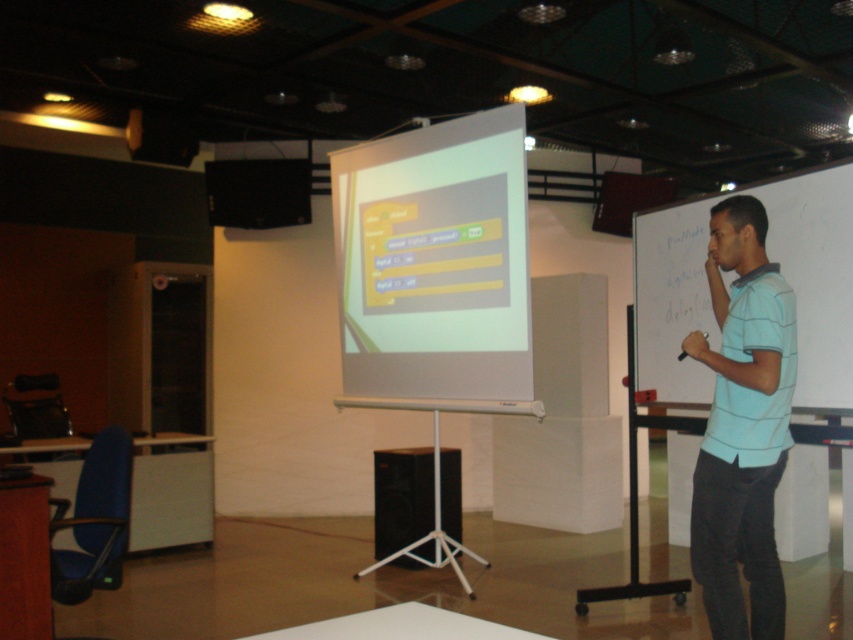
Based on the photo, does light blue striped shirt at right come behind black plastic speaker at upper left?

No, it is in front of black plastic speaker at upper left.

Can you confirm if light blue striped shirt at right is wider than black plastic speaker at upper left?

In fact, light blue striped shirt at right might be narrower than black plastic speaker at upper left.

Image resolution: width=853 pixels, height=640 pixels. What do you see at coordinates (741, 426) in the screenshot? I see `light blue striped shirt at right` at bounding box center [741, 426].

The width and height of the screenshot is (853, 640). What are the coordinates of `light blue striped shirt at right` in the screenshot? It's located at (741, 426).

Describe the element at coordinates (434, 260) in the screenshot. I see `white glossy projector screen at center` at that location.

Is white glossy projector screen at center behind black plastic speaker at upper left?

No, it is in front of black plastic speaker at upper left.

Find the location of a particular element. white glossy projector screen at center is located at coordinates [x=434, y=260].

Does white glossy projector screen at center have a greater width compared to black matte speaker at center?

Yes, white glossy projector screen at center is wider than black matte speaker at center.

Who is more forward, (398, 218) or (430, 476)?

Positioned in front is point (398, 218).

Image resolution: width=853 pixels, height=640 pixels. In order to click on white glossy projector screen at center in this screenshot , I will do `click(434, 260)`.